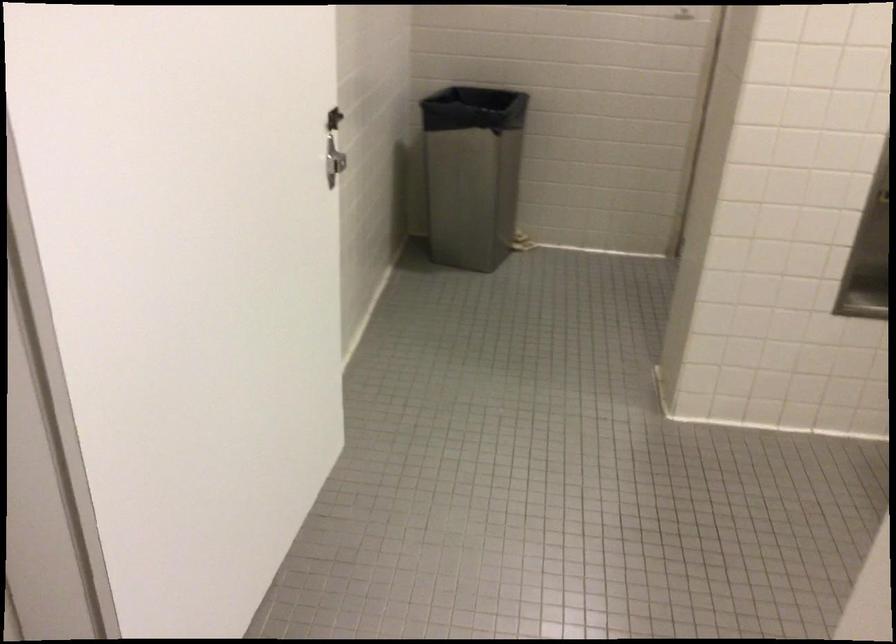
Find where to lift the black trash bag. Please return your answer as a coordinate pair (x, y).

(471, 173)